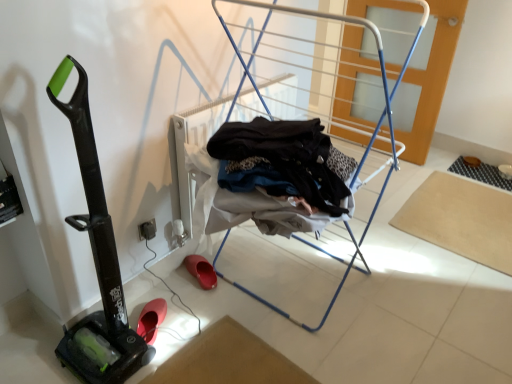
At what (x,y) coordinates should I click in order to perform the action: click on vacant space in front of rubber/matte clog at lower left, which is the 2th footwear from front to back. Please return your answer as a coordinate pair (x, y). The image size is (512, 384). Looking at the image, I should click on (199, 295).